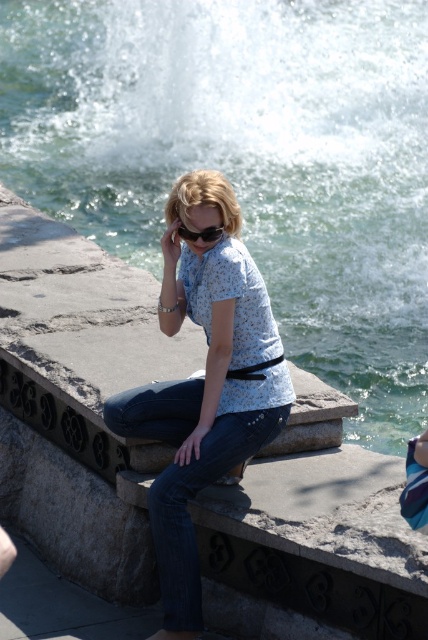
Measure the distance from clear water at center to black matte goggles at center.

clear water at center is 74.72 feet from black matte goggles at center.

Between point (362, 157) and point (211, 237), which one is positioned in front?

Point (211, 237) is in front.

Who is more distant from viewer, (383, 122) or (193, 237)?

The point (383, 122) is more distant.

The image size is (428, 640). Identify the location of clear water at center. (247, 160).

Is clear water at center bigger than denim at center?

Indeed, clear water at center has a larger size compared to denim at center.

Is clear water at center positioned behind denim at center?

That is True.

Between point (348, 108) and point (189, 611), which one is positioned in front?

Positioned in front is point (189, 611).

Locate an element on the screen. clear water at center is located at coordinates (247, 160).

Can you confirm if denim at center is taller than black matte goggles at center?

Indeed, denim at center has a greater height compared to black matte goggles at center.

Between denim at center and black matte goggles at center, which one is positioned lower?

denim at center is below.

What do you see at coordinates (187, 476) in the screenshot? I see `denim at center` at bounding box center [187, 476].

This screenshot has width=428, height=640. Identify the location of denim at center. (187, 476).